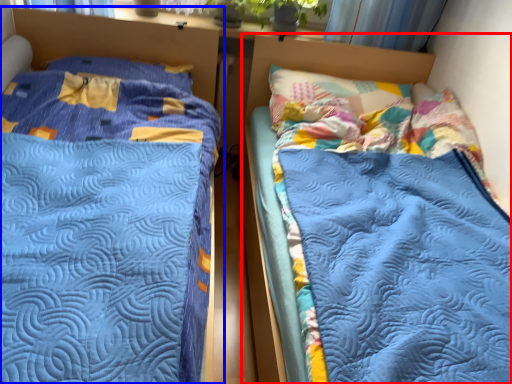
Question: Which of the following is the farthest to the observer, bed (highlighted by a red box) or bed (highlighted by a blue box)?

Choices:
 (A) bed
 (B) bed

Answer: (A)